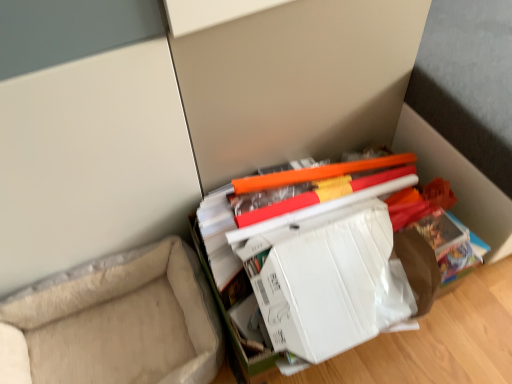
Question: Is beige fabric couch at lower left spatially inside white cardboard box at center, or outside of it?

Choices:
 (A) outside
 (B) inside

Answer: (A)

Question: Looking at the image, does beige fabric couch at lower left seem bigger or smaller compared to white cardboard box at center?

Choices:
 (A) big
 (B) small

Answer: (A)

Question: From a real-world perspective, relative to white cardboard box at center, is beige fabric couch at lower left vertically above or below?

Choices:
 (A) below
 (B) above

Answer: (A)

Question: From a real-world perspective, relative to beige fabric couch at lower left, is white cardboard box at center vertically above or below?

Choices:
 (A) above
 (B) below

Answer: (A)

Question: Looking at the image, does white cardboard box at center seem bigger or smaller compared to beige fabric couch at lower left?

Choices:
 (A) small
 (B) big

Answer: (A)

Question: From the image's perspective, relative to beige fabric couch at lower left, is white cardboard box at center above or below?

Choices:
 (A) below
 (B) above

Answer: (B)

Question: Is white cardboard box at center taller or shorter than beige fabric couch at lower left?

Choices:
 (A) short
 (B) tall

Answer: (B)